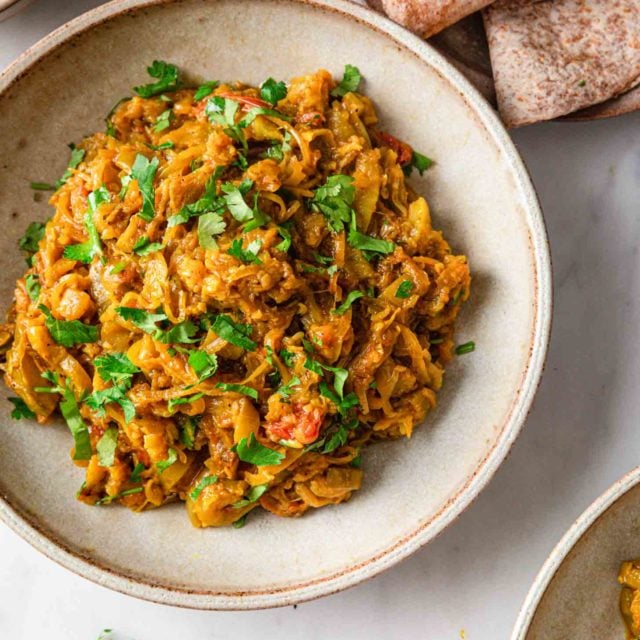
Locate an element on the screen. The image size is (640, 640). table is located at coordinates (580, 196).